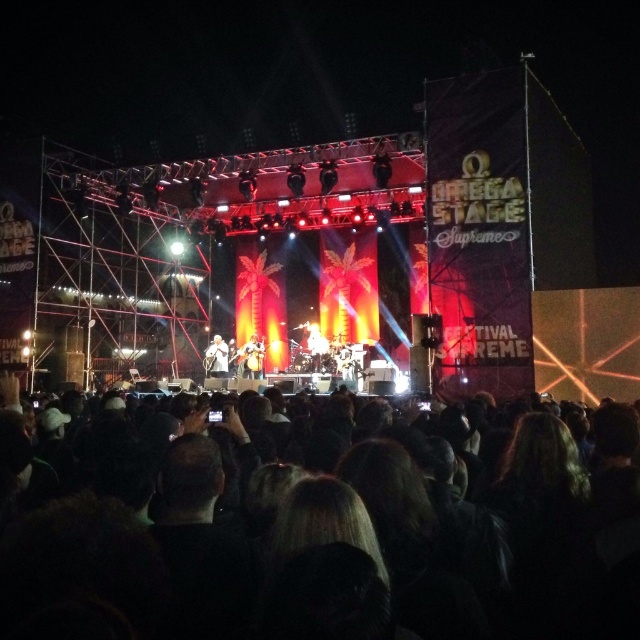
You are a stagehand at the Omega Stage Supreme concert. You need to place a new microphone stand exactly at the center of the stage. The stage has a coordinate system where the bottom left corner is the origin point. The coordinates of the center are marked by point (252, 356). Is the matte black guitar at center located at the center of the stage?

Yes, the point (252, 356) marks the matte black guitar at center, which means it is located at the center of the stage.

You are a stagehand at the Omega Stage Supreme concert. You need to place a new spotlight on the stage. You have two options for placement coordinates given as points on the stage layout. The first point is at coordinates point (248, 360) and the second is at point (214, 336). Which of these points is closer to the audience? Please answer based on their positions relative to each other.

Point (248, 360) is in front of point (214, 336), so it is closer to the audience.

You are a photographer standing at the back of the Omega Stage Supreme concert venue. You notice a performer with black hair at lower center on stage. If your camera has a maximum focus range of 150 feet, will you be able to clearly capture their hair in your photo?

The black hair at lower center is 155.13 feet away from the viewer. Since the camera can only focus up to 150 feet, it won not be able to clearly capture the black hair at lower center in the photo.